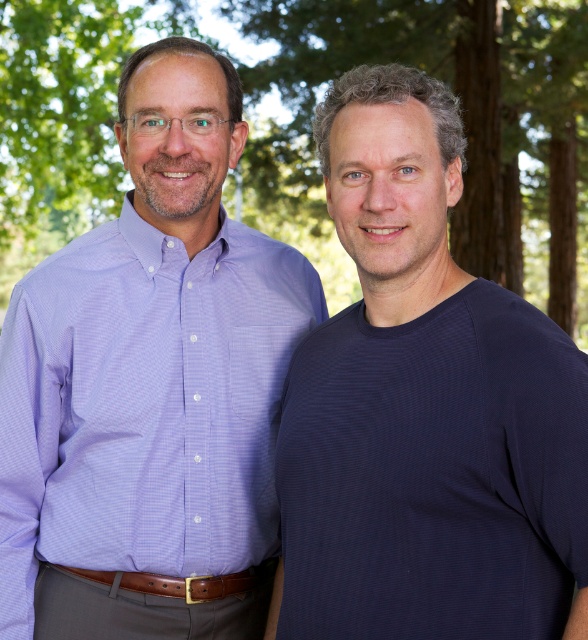
Question: Considering the real-world distances, which object is farthest from the green leafy tree at upper center?

Choices:
 (A) lavender woven shirt at left
 (B) dark blue ribbed t-shirt at right

Answer: (B)

Question: Is green leafy tree at upper center to the left of lavender woven shirt at left from the viewer's perspective?

Choices:
 (A) yes
 (B) no

Answer: (B)

Question: Which point appears closest to the camera in this image?

Choices:
 (A) (246, 292)
 (B) (376, 497)
 (C) (302, 28)

Answer: (B)

Question: Can you confirm if green leafy tree at upper center is wider than lavender woven shirt at left?

Choices:
 (A) yes
 (B) no

Answer: (A)

Question: Does dark blue ribbed t-shirt at right have a greater width compared to lavender woven shirt at left?

Choices:
 (A) yes
 (B) no

Answer: (B)

Question: Which object is closer to the camera taking this photo?

Choices:
 (A) dark blue ribbed t-shirt at right
 (B) green leafy tree at upper center
 (C) lavender woven shirt at left

Answer: (A)